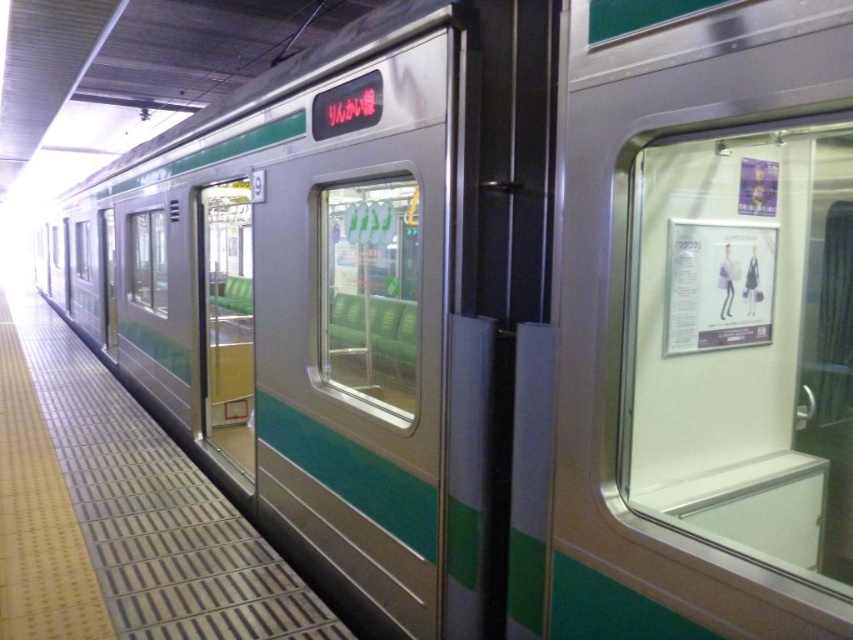
Question: Can you confirm if smooth concrete platform at center is smaller than green matte door at center?

Choices:
 (A) yes
 (B) no

Answer: (B)

Question: Does smooth concrete platform at center have a greater width compared to green matte door at center?

Choices:
 (A) no
 (B) yes

Answer: (B)

Question: Does smooth concrete platform at center appear on the left side of green matte door at center?

Choices:
 (A) no
 (B) yes

Answer: (B)